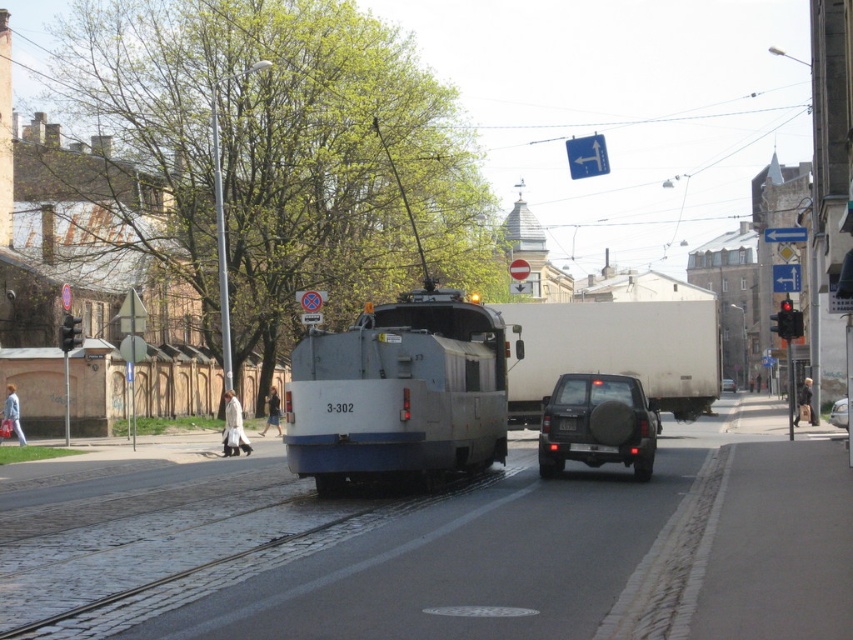
Question: Which point appears closest to the camera in this image?

Choices:
 (A) (845, 412)
 (B) (585, 426)

Answer: (B)

Question: Among these objects, which one is nearest to the camera?

Choices:
 (A) metallic silver suv at center
 (B) white matte truck at center
 (C) white matte garbage truck at center

Answer: (C)

Question: Is white matte garbage truck at center positioned at the back of metallic silver car at center?

Choices:
 (A) no
 (B) yes

Answer: (A)

Question: Does dark gray matte suv at center come in front of metallic silver car at center?

Choices:
 (A) no
 (B) yes

Answer: (B)

Question: Does metallic silver car at center appear over metallic silver suv at center?

Choices:
 (A) yes
 (B) no

Answer: (A)

Question: Which point is farther to the camera?

Choices:
 (A) (837, 426)
 (B) (730, 384)

Answer: (B)